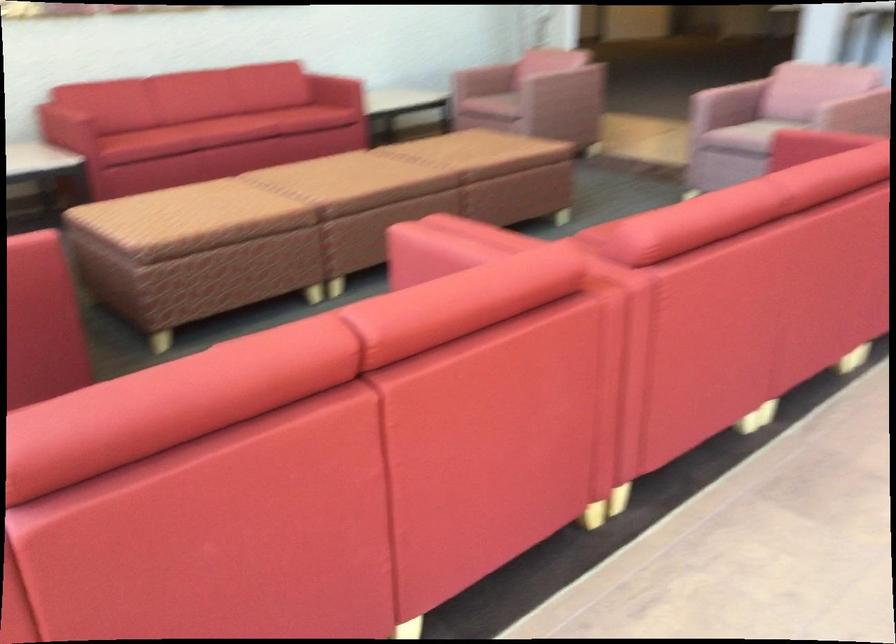
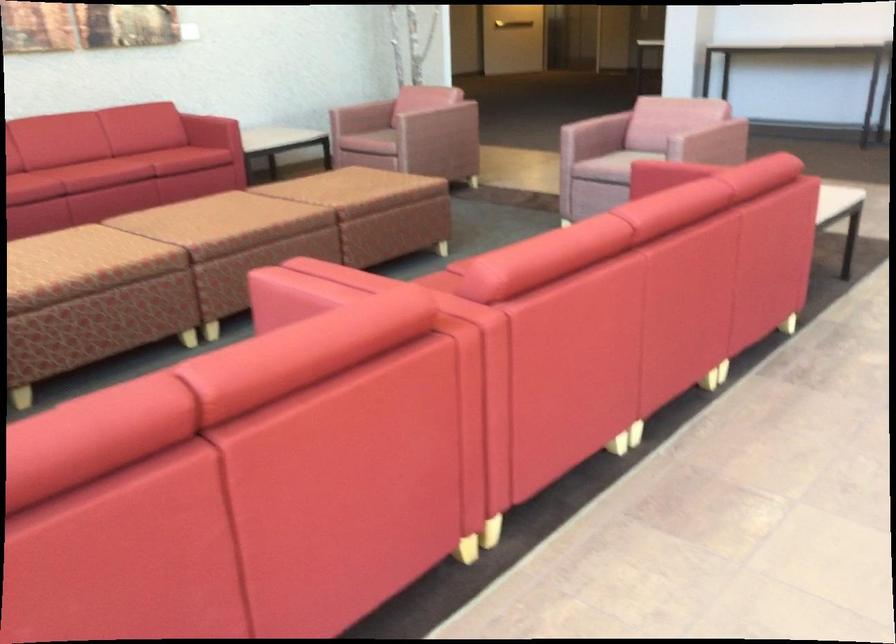
Find the pixel in the second image that matches [503,176] in the first image.

(380, 212)